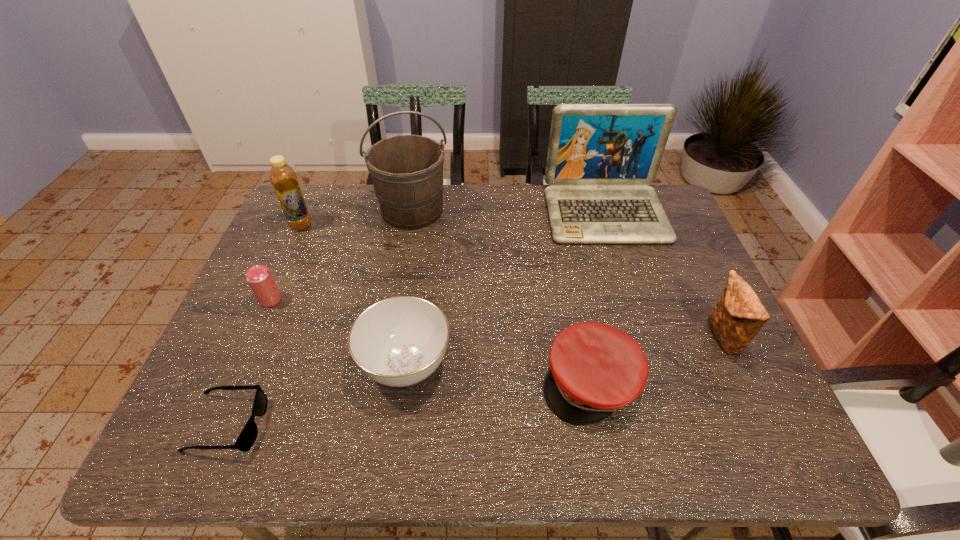
Locate an element on the screen. The height and width of the screenshot is (540, 960). vacant space located on the front of the sixth shortest object is located at coordinates (289, 253).

Find the location of `vacant region located on the open side of the fifth shortest object`. vacant region located on the open side of the fifth shortest object is located at coordinates pyautogui.click(x=594, y=338).

This screenshot has height=540, width=960. I want to click on vacant area located 0.230m on the open side of the fifth shortest object, so click(x=614, y=338).

This screenshot has height=540, width=960. I want to click on vacant space positioned 0.220m on the open side of the fifth shortest object, so click(x=618, y=338).

Where is `vacant region located 0.190m on the back of the chinaware`? The image size is (960, 540). vacant region located 0.190m on the back of the chinaware is located at coordinates (419, 273).

Identify the location of vacant space located 0.140m on the front of the fifth nearest object. This screenshot has height=540, width=960. (247, 353).

In order to click on free spot located 0.050m at the front of the cap where the visor is located in this screenshot , I will do `click(603, 450)`.

Identify the location of vacant space located 0.370m on the front-facing side of the sunglasses. The image size is (960, 540). (441, 424).

The height and width of the screenshot is (540, 960). I want to click on bucket present at the far edge, so 407,170.

The image size is (960, 540). I want to click on laptop computer that is at the far edge, so click(601, 157).